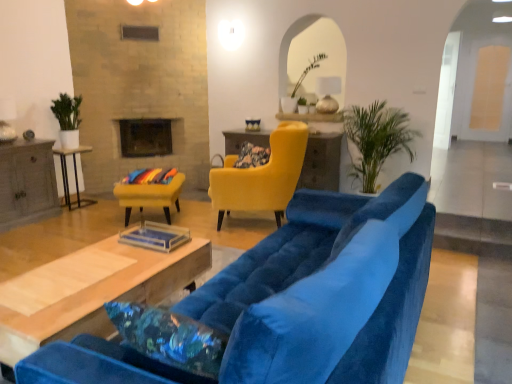
Locate an element on the screen. The height and width of the screenshot is (384, 512). velvet blue couch at center is located at coordinates (326, 291).

In order to face wooden table at center, marked as the first table in a right-to-left arrangement, should I rotate leftwards or rightwards?

Rotate right and turn 3.485 degrees.

What do you see at coordinates (150, 196) in the screenshot?
I see `velvet yellow armchair at center, which is the 2th chair from right to left` at bounding box center [150, 196].

Find the location of a particular element. velvet blue couch at center is located at coordinates (x=326, y=291).

Find the location of a particular element. This screenshot has width=512, height=384. the 2nd chair directly beneath the floral fabric pillow at center (from a real-world perspective) is located at coordinates (150, 196).

Is velvet yellow armchair at center, the first chair in the left-to-right sequence, looking in the opposite direction of floral fabric pillow at center?

No, velvet yellow armchair at center, the first chair in the left-to-right sequence, is not facing the opposite direction of floral fabric pillow at center.

Is velvet yellow armchair at center, the first chair in the left-to-right sequence, placed right next to floral fabric pillow at center?

No, velvet yellow armchair at center, the first chair in the left-to-right sequence, is not beside floral fabric pillow at center.

From the image's perspective, which one is positioned lower, velvet yellow armchair at center, the first chair in the left-to-right sequence, or floral fabric pillow at center?

From the image's view, velvet yellow armchair at center, the first chair in the left-to-right sequence, is below.

Considering the relative positions of matte yellow armchair at center, the 1th chair positioned from the right, and wooden table at center, which appears as the fourth table when viewed from the front, in the image provided, is matte yellow armchair at center, the 1th chair positioned from the right, to the right of wooden table at center, which appears as the fourth table when viewed from the front, from the viewer's perspective?

In fact, matte yellow armchair at center, the 1th chair positioned from the right, is to the left of wooden table at center, which appears as the fourth table when viewed from the front.

Where is `table on the right side of matte yellow armchair at center, marked as the 2th chair in a left-to-right arrangement`? table on the right side of matte yellow armchair at center, marked as the 2th chair in a left-to-right arrangement is located at coordinates (321, 162).

What's the angular difference between matte yellow armchair at center, marked as the 2th chair in a left-to-right arrangement, and wooden table at center, acting as the 1th table starting from the back,'s facing directions?

The angle between the facing direction of matte yellow armchair at center, marked as the 2th chair in a left-to-right arrangement, and the facing direction of wooden table at center, acting as the 1th table starting from the back, is 67.5 degrees.

From a real-world perspective, which is physically above, matte yellow armchair at center, marked as the 2th chair in a left-to-right arrangement, or wooden table at center, which appears as the fourth table when viewed from the front?

In real-world perspective, matte yellow armchair at center, marked as the 2th chair in a left-to-right arrangement, is above.

Can you confirm if green leafy plant at right is taller than matte yellow armchair at center, the 1th chair positioned from the right?

Correct, green leafy plant at right is much taller as matte yellow armchair at center, the 1th chair positioned from the right.

The image size is (512, 384). I want to click on houseplant on the right of matte yellow armchair at center, the 1th chair positioned from the right, so click(x=376, y=139).

Between green leafy plant at right and matte yellow armchair at center, marked as the 2th chair in a left-to-right arrangement, which one has larger size?

green leafy plant at right.

Between wooden table at center, which appears as the fourth table when viewed from the front, and green leafy plant at right, which one appears on the right side from the viewer's perspective?

Positioned to the right is green leafy plant at right.

Does wooden table at center, which appears as the fourth table when viewed from the front, contain green leafy plant at right?

No, green leafy plant at right is not inside wooden table at center, which appears as the fourth table when viewed from the front.

Between wooden table at center, which appears as the fourth table when viewed from the front, and green leafy plant at right, which one has larger size?

With larger size is green leafy plant at right.

Is floral fabric pillow at center spatially inside wooden table at center, marked as the first table in a right-to-left arrangement, or outside of it?

floral fabric pillow at center lies outside wooden table at center, marked as the first table in a right-to-left arrangement.

Is floral fabric pillow at center to the right of wooden table at center, the fourth table when ordered from left to right, from the viewer's perspective?

No, floral fabric pillow at center is not to the right of wooden table at center, the fourth table when ordered from left to right.

Considering the sizes of objects floral fabric pillow at center and wooden table at center, which appears as the fourth table when viewed from the front, in the image provided, who is taller, floral fabric pillow at center or wooden table at center, which appears as the fourth table when viewed from the front,?

wooden table at center, which appears as the fourth table when viewed from the front.

Who is shorter, green leafy plant at right or gray wood side table at left, which is the 2th table from front to back?

gray wood side table at left, which is the 2th table from front to back.

Is green leafy plant at right closer to camera compared to gray wood side table at left, marked as the third table in a back-to-front arrangement?

That is True.

In the image, is green leafy plant at right on the left side or the right side of gray wood side table at left, which ranks as the fourth table in right-to-left order?

In the image, green leafy plant at right appears on the right side of gray wood side table at left, which ranks as the fourth table in right-to-left order.

Can you confirm if floral fabric pillow at center is bigger than velvet yellow armchair at center, the first chair in the left-to-right sequence?

No.

Between floral fabric pillow at center and velvet yellow armchair at center, which is the 2th chair from right to left, which one is positioned in front?

Positioned in front is velvet yellow armchair at center, which is the 2th chair from right to left.

Considering the relative positions of floral fabric pillow at center and velvet yellow armchair at center, the first chair in the left-to-right sequence, in the image provided, is floral fabric pillow at center to the left of velvet yellow armchair at center, the first chair in the left-to-right sequence, from the viewer's perspective?

No, floral fabric pillow at center is not to the left of velvet yellow armchair at center, the first chair in the left-to-right sequence.

Between floral fabric pillow at center and velvet yellow armchair at center, the first chair in the left-to-right sequence, which one has more height?

velvet yellow armchair at center, the first chair in the left-to-right sequence.

Image resolution: width=512 pixels, height=384 pixels. What are the coordinates of `the 2nd chair located beneath the floral fabric pillow at center (from a real-world perspective)` in the screenshot? It's located at (150, 196).

Starting from the matte yellow armchair at center, the 1th chair positioned from the right, which table is the 3rd one behind? Please provide its 2D coordinates.

[(321, 162)]

Looking at the image, which one is located further to gray wood side table at left, which is counted as the first table, starting from the left, wooden coffee table at center, marked as the second table in a right-to-left arrangement, or matte yellow armchair at center, the 1th chair positioned from the right?

The object further to gray wood side table at left, which is counted as the first table, starting from the left, is wooden coffee table at center, marked as the second table in a right-to-left arrangement.

Estimate the real-world distances between objects in this image. Which object is closer to green leafy plant at right, wooden coffee table at center, the 3th table positioned from the left, or floral fabric pillow at center?

The object closer to green leafy plant at right is floral fabric pillow at center.

Based on their spatial positions, is velvet blue couch at center or green leafy plant at right further from green leafy plant at upper center?

velvet blue couch at center lies further to green leafy plant at upper center than the other object.

Which object lies nearer to the anchor point floral fabric pillow at center, green leafy plant at upper center or matte yellow armchair at center, marked as the 2th chair in a left-to-right arrangement?

The object closer to floral fabric pillow at center is matte yellow armchair at center, marked as the 2th chair in a left-to-right arrangement.

Looking at this image, from the image, which object appears to be farther from matte yellow armchair at center, the 1th chair positioned from the right, black glass fireplace at upper center or floral fabric pillow at center?

black glass fireplace at upper center lies further to matte yellow armchair at center, the 1th chair positioned from the right, than the other object.

Considering their positions, is gray wood side table at left, which is the 2th table from front to back, positioned further to green leafy plant at right than wooden table at center, acting as the 1th table starting from the back?

gray wood side table at left, which is the 2th table from front to back, lies further to green leafy plant at right than the other object.

Considering their positions, is wooden table at center, the fourth table when ordered from left to right, positioned further to gray wood side table at left, marked as the third table in a back-to-front arrangement, than matte yellow armchair at center, marked as the 2th chair in a left-to-right arrangement?

wooden table at center, the fourth table when ordered from left to right, is further to gray wood side table at left, marked as the third table in a back-to-front arrangement.

Which object lies further to the anchor point velvet blue couch at center, matte yellow armchair at center, the 1th chair positioned from the right, or white glossy side table at left, acting as the third table starting from the front?

white glossy side table at left, acting as the third table starting from the front, lies further to velvet blue couch at center than the other object.

Where is `pillow between velvet blue couch at center and wooden table at center, marked as the first table in a right-to-left arrangement, along the z-axis`? The height and width of the screenshot is (384, 512). pillow between velvet blue couch at center and wooden table at center, marked as the first table in a right-to-left arrangement, along the z-axis is located at coordinates (252, 156).

I want to click on pillow situated between gray wood side table at left, marked as the third table in a back-to-front arrangement, and wooden table at center, the fourth table when ordered from left to right, from left to right, so click(x=252, y=156).

Where is `plant located between velvet blue couch at center and black glass fireplace at upper center in the depth direction`? plant located between velvet blue couch at center and black glass fireplace at upper center in the depth direction is located at coordinates (309, 70).

Find the location of `pillow between green leafy plant at upper center and wooden table at center, marked as the first table in a right-to-left arrangement, in the vertical direction`. pillow between green leafy plant at upper center and wooden table at center, marked as the first table in a right-to-left arrangement, in the vertical direction is located at coordinates (252, 156).